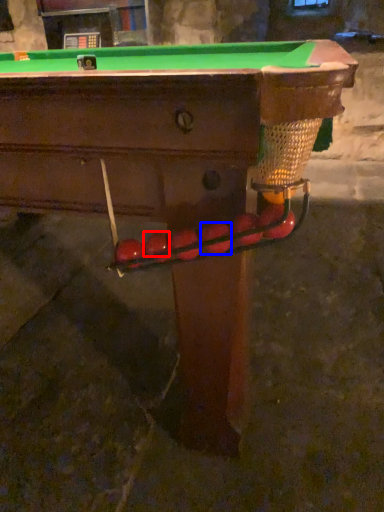
Question: Which object appears closest to the camera in this image, fruit (highlighted by a red box) or fruit (highlighted by a blue box)?

Choices:
 (A) fruit
 (B) fruit

Answer: (B)